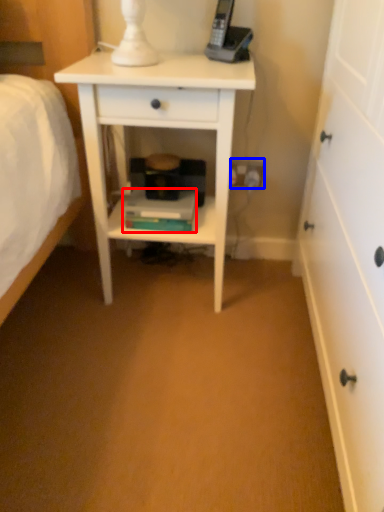
Question: Which object is further to the camera taking this photo, book (highlighted by a red box) or electric outlet (highlighted by a blue box)?

Choices:
 (A) book
 (B) electric outlet

Answer: (B)